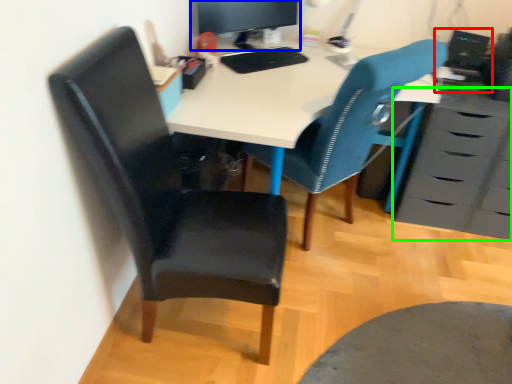
Question: Considering the real-world distances, which object is farthest from computer (highlighted by a red box)? computer monitor (highlighted by a blue box) or chest of drawers (highlighted by a green box)?

Choices:
 (A) computer monitor
 (B) chest of drawers

Answer: (A)